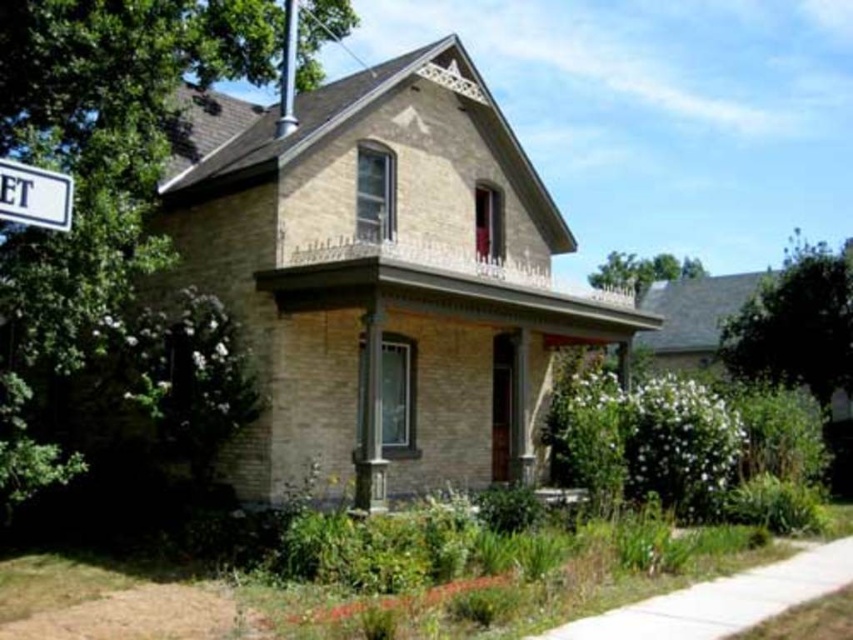
Does white plastic street sign at upper left appear under silver metallic pole at upper center?

Correct, white plastic street sign at upper left is located below silver metallic pole at upper center.

Is white plastic street sign at upper left to the left of silver metallic pole at upper center from the viewer's perspective?

Correct, you'll find white plastic street sign at upper left to the left of silver metallic pole at upper center.

Is point (44, 170) farther from viewer compared to point (287, 4)?

No, (44, 170) is closer to viewer.

Where is `white plastic street sign at upper left`? white plastic street sign at upper left is located at coordinates (33, 195).